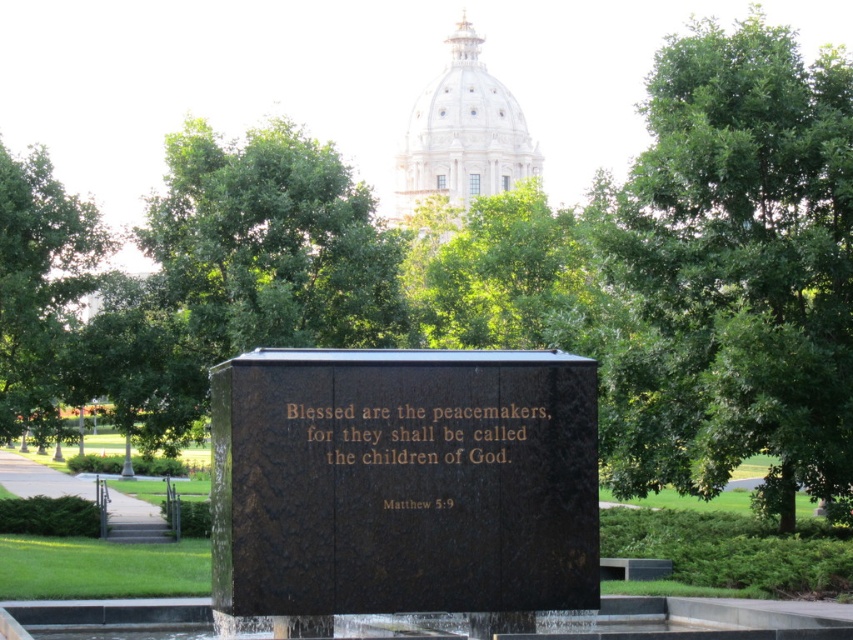
Can you confirm if green leafy tree at center is smaller than bronze textured plaque at center?

Incorrect, green leafy tree at center is not smaller in size than bronze textured plaque at center.

Between green leafy tree at center and bronze textured plaque at center, which one is positioned lower?

Positioned lower is bronze textured plaque at center.

Find the location of a particular element. The image size is (853, 640). green leafy tree at center is located at coordinates (732, 272).

Is green leafy tree at left to the left of goldmaterial/textureinscription at center from the viewer's perspective?

Yes, green leafy tree at left is to the left of goldmaterial/textureinscription at center.

Between green leafy tree at left and goldmaterial/textureinscription at center, which one has more height?

With more height is green leafy tree at left.

What do you see at coordinates (39, 289) in the screenshot? I see `green leafy tree at left` at bounding box center [39, 289].

In order to click on green leafy tree at left in this screenshot , I will do `click(39, 289)`.

Between bronze textured plaque at center and green leafy tree at left, which one has more height?

green leafy tree at left

Is the position of bronze textured plaque at center less distant than that of green leafy tree at left?

Yes, it is in front of green leafy tree at left.

Is point (223, 500) farther from camera compared to point (68, 355)?

No, (223, 500) is in front of (68, 355).

At what (x,y) coordinates should I click in order to perform the action: click on bronze textured plaque at center. Please return your answer as a coordinate pair (x, y). This screenshot has height=640, width=853. Looking at the image, I should click on (403, 481).